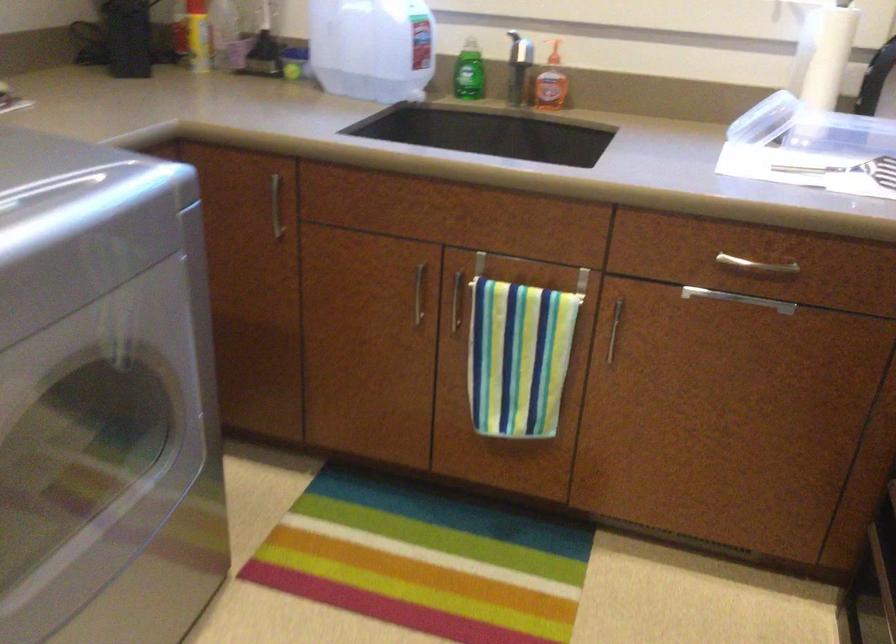
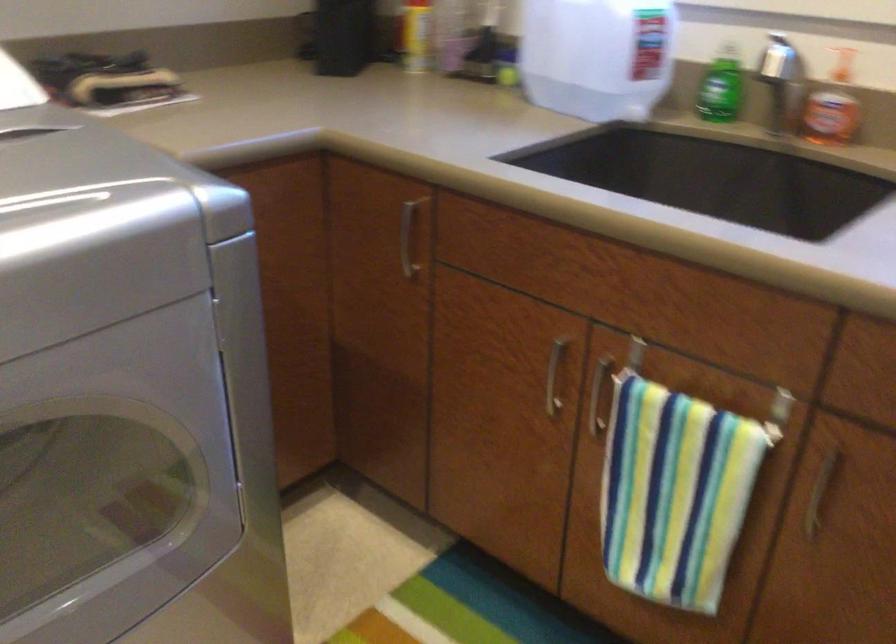
Locate, in the second image, the point that corresponds to (470,71) in the first image.

(721, 88)